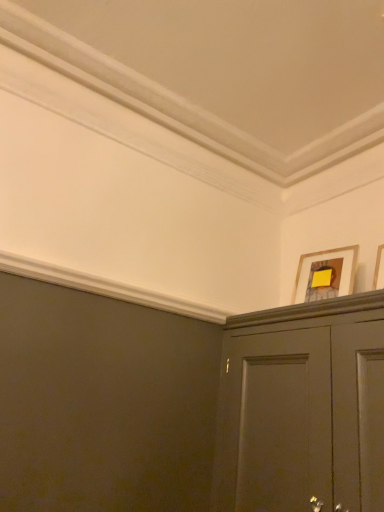
Question: Relative to wooden picture frame at upper right, which ranks as the 2th picture frame in back-to-front order, is wooden framed picture at upper right, which ranks as the second picture frame in front-to-back order, in front or behind?

Choices:
 (A) front
 (B) behind

Answer: (B)

Question: Looking at the image, does wooden framed picture at upper right, which ranks as the second picture frame in front-to-back order, seem bigger or smaller compared to wooden picture frame at upper right, which ranks as the 2th picture frame in back-to-front order?

Choices:
 (A) small
 (B) big

Answer: (B)

Question: From the image's perspective, is wooden framed picture at upper right, which ranks as the second picture frame in front-to-back order, positioned above or below wooden picture frame at upper right, the first picture frame positioned from the front?

Choices:
 (A) above
 (B) below

Answer: (B)

Question: Would you say wooden picture frame at upper right, the first picture frame positioned from the front, is inside or outside wooden framed picture at upper right, which ranks as the second picture frame in front-to-back order?

Choices:
 (A) outside
 (B) inside

Answer: (A)

Question: Is wooden picture frame at upper right, which ranks as the 2th picture frame in back-to-front order, bigger or smaller than wooden framed picture at upper right, placed as the 1th picture frame when sorted from back to front?

Choices:
 (A) big
 (B) small

Answer: (B)

Question: From the image's perspective, is wooden picture frame at upper right, the first picture frame positioned from the front, positioned above or below wooden framed picture at upper right, which ranks as the second picture frame in front-to-back order?

Choices:
 (A) below
 (B) above

Answer: (B)

Question: In terms of height, does wooden picture frame at upper right, which ranks as the 2th picture frame in back-to-front order, look taller or shorter compared to wooden framed picture at upper right, which ranks as the second picture frame in front-to-back order?

Choices:
 (A) short
 (B) tall

Answer: (B)